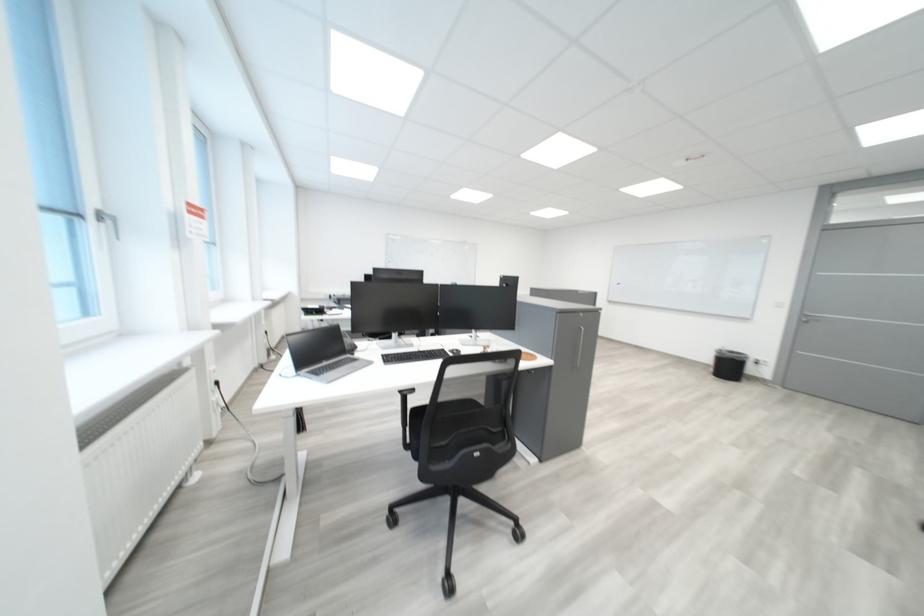
Describe the element at coordinates (810, 317) in the screenshot. I see `the silver door handle` at that location.